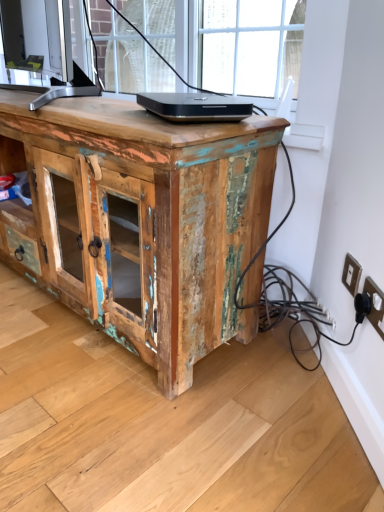
Image resolution: width=384 pixels, height=512 pixels. I want to click on free space to the left of black glossy laptop at center, so click(x=97, y=110).